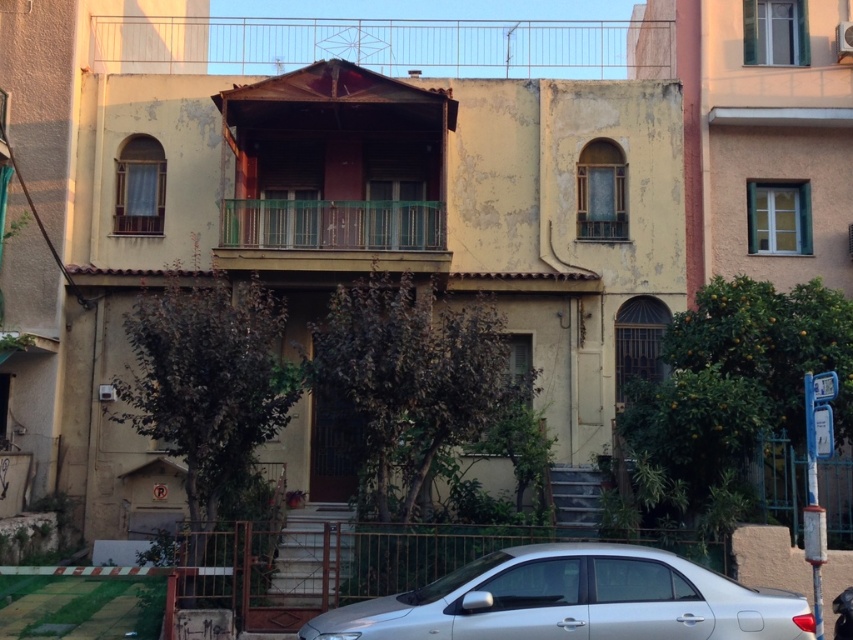
Question: Does silver metallic car at lower center have a smaller size compared to rustic wood balcony at upper center?

Choices:
 (A) yes
 (B) no

Answer: (A)

Question: Among these objects, which one is nearest to the camera?

Choices:
 (A) rustic wood balcony at upper center
 (B) green glass railing at center
 (C) silver metallic car at lower center

Answer: (C)

Question: Is silver metallic car at lower center closer to camera compared to rustic wood balcony at upper center?

Choices:
 (A) no
 (B) yes

Answer: (B)

Question: Can you confirm if rustic wood balcony at upper center is positioned to the right of green glass railing at center?

Choices:
 (A) yes
 (B) no

Answer: (A)

Question: Estimate the real-world distances between objects in this image. Which object is closer to the rustic wood balcony at upper center?

Choices:
 (A) silver metallic car at lower center
 (B) green glass railing at center

Answer: (B)

Question: Which point is closer to the camera taking this photo?

Choices:
 (A) (424, 216)
 (B) (502, 577)
 (C) (596, 20)

Answer: (B)